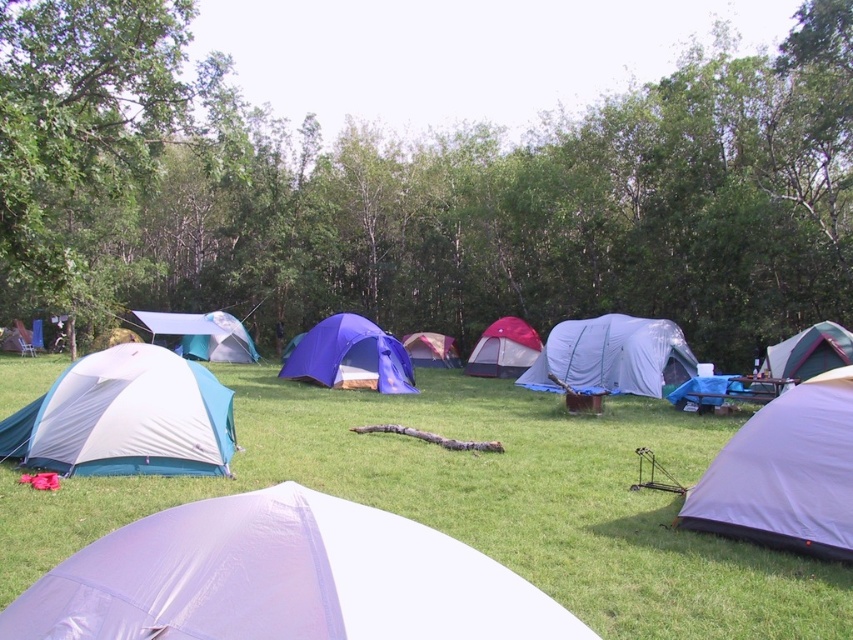
You are standing at the viewpoint of the image and want to place a small flag at both point (120,435) and point (845,339). Which point is closer to you where you should place the flag first?

Point (120,435) is closer to the viewer than point (845,339), so you should place the flag there first.